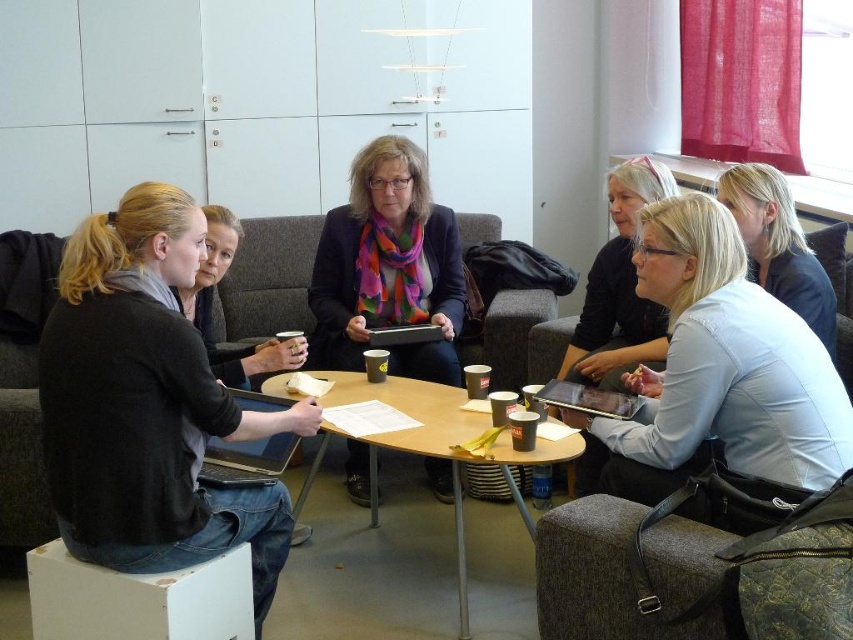
Question: Estimate the real-world distances between objects in this image. Which object is closer to the wooden table at center?

Choices:
 (A) blonde hair at upper right
 (B) matte black jacket at center
 (C) silver metallic laptop at center
 (D) light blue fabric shirt at center

Answer: (C)

Question: Does matte black laptop at center appear over silver metallic laptop at center?

Choices:
 (A) yes
 (B) no

Answer: (A)

Question: Among these points, which one is nearest to the camera?

Choices:
 (A) (399, 410)
 (B) (207, 298)
 (C) (708, 371)

Answer: (C)

Question: Which of these objects is positioned closest to the blonde hair at upper right?

Choices:
 (A) light blue fabric shirt at center
 (B) matte black jacket at center

Answer: (A)

Question: Does blonde hair at upper right have a larger size compared to matte black laptop at center?

Choices:
 (A) no
 (B) yes

Answer: (A)

Question: Does matte black jacket at center appear on the right side of matte black laptop at center?

Choices:
 (A) no
 (B) yes

Answer: (B)